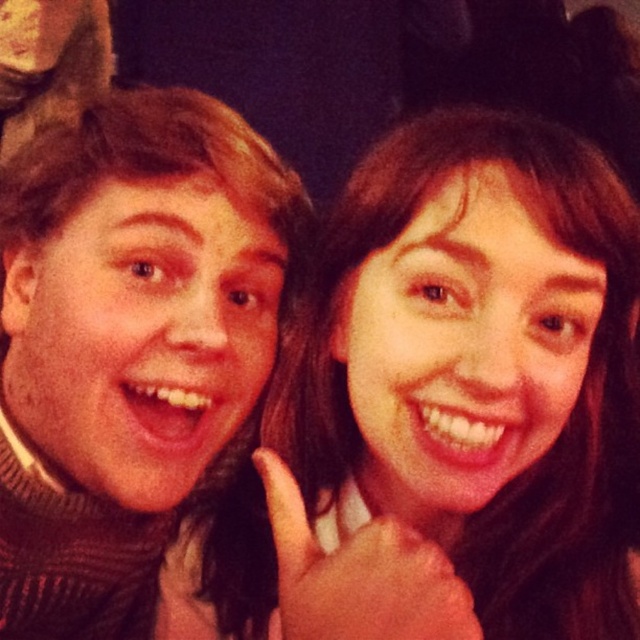
You are a photographer adjusting the focus of your camera. The camera is currently set to focus on the smooth skin face at center. If you want to capture both people clearly in the photo, is the current focus distance sufficient?

The smooth skin face at center is 15.38 inches away from the camera. Since both individuals are posing closely together, the focus distance should be sufficient to capture both clearly as they are likely within the depth of field at this distance.

You are a photographer adjusting the focus on your camera. You want to ensure that both the smooth skin face at center and the matte brown sweater at left are in sharp focus. Given that the depth of field can only clearly focus on one object at a time, which object should you prioritize focusing on to ensure it is the sharpest in the photo?

The smooth skin face at center is closer to the viewer than the matte brown sweater at left. To ensure the face is the sharpest, focus on the smooth skin face at center since it is closer and will be in focus when the sweater might be slightly blurred.

You are a photographer trying to capture a closeup of the two people in the image. The matte brown sweater at left and the smooth skin hand at center are both in the frame. Based on their sizes, can you tell which one is more likely to be in focus if the camera is set to auto focus on the closest object?

The matte brown sweater at left is wider than the smooth skin hand at center, so the camera will likely focus on the matte brown sweater at left since it is closer to the camera.